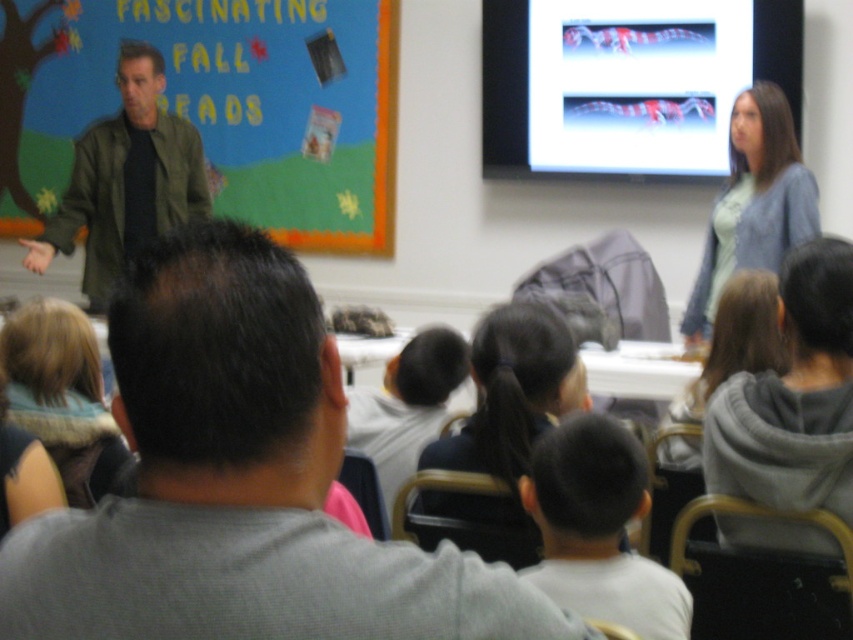
You are a photographer trying to capture a group photo of the black hair at center and the light blue cardigan at upper right. You need to ensure both subjects are fully visible in the frame. Based on their sizes, which subject requires more space in the photo?

The black hair at center requires more space in the photo because its width is larger than the light blue cardigan at upper right.

You are a student sitting in the classroom. You notice two items in front of you. One is the smooth gray shirt at center and the other is the green matte jacket at left. Which item is positioned lower from your viewpoint?

The smooth gray shirt at center is positioned lower than the green matte jacket at left from your viewpoint.